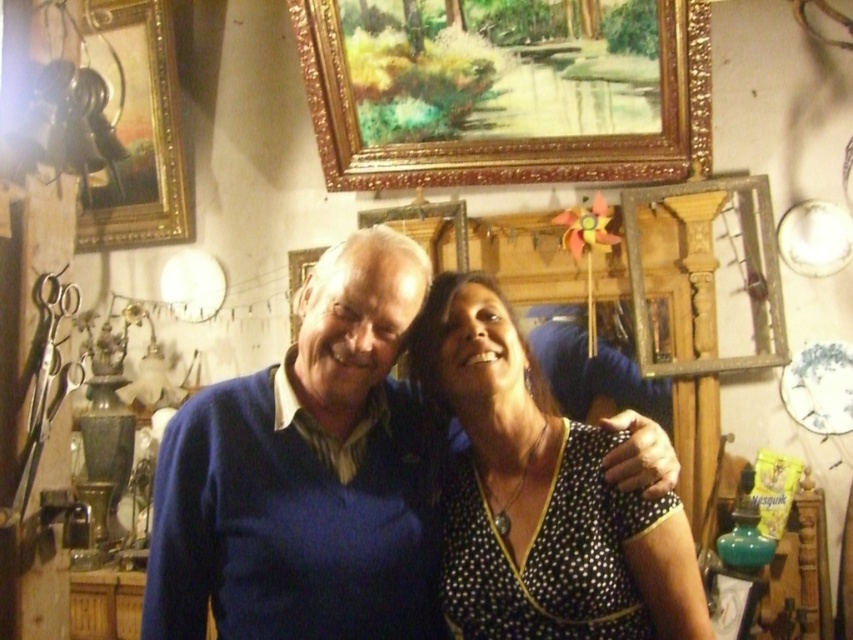
Question: Which point is farther to the camera?

Choices:
 (A) goldmetallicpicture frame at upper left
 (B) blue matte sweater at center

Answer: (A)

Question: Among these objects, which one is nearest to the camera?

Choices:
 (A) gold ornate picture frame at upper center
 (B) black dotted dress at center
 (C) goldmetallicpicture frame at upper left
 (D) blue matte sweater at center

Answer: (B)

Question: Which of the following is the closest to the observer?

Choices:
 (A) goldmetallicpicture frame at upper left
 (B) gold ornate picture frame at upper center
 (C) black dotted dress at center
 (D) blue matte sweater at center

Answer: (C)

Question: Observing the image, what is the correct spatial positioning of blue matte sweater at center in reference to goldmetallicpicture frame at upper left?

Choices:
 (A) right
 (B) left

Answer: (A)

Question: Can you confirm if gold ornate picture frame at upper center is positioned below goldmetallicpicture frame at upper left?

Choices:
 (A) no
 (B) yes

Answer: (A)

Question: Does gold ornate picture frame at upper center come behind black dotted dress at center?

Choices:
 (A) yes
 (B) no

Answer: (A)